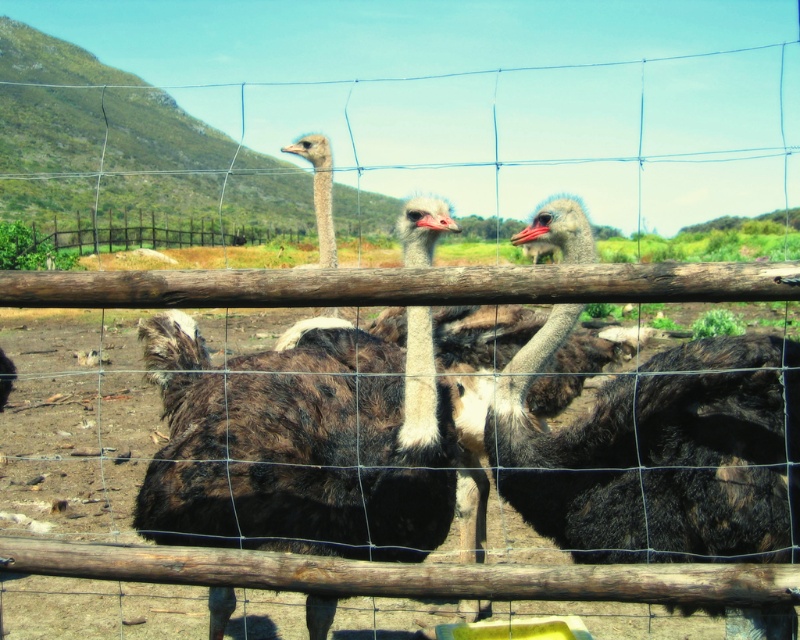
You are standing outside the enclosure looking at the dark brown feathered ostrich at center and the dark brown feathers at center. Which object is closer to you?

The dark brown feathered ostrich at center is closer to you because the dark brown feathers at center are behind it.

You are a farmer checking the ostriches in their enclosure. You notice the dark brown feathered ostrich at center and the dark brown feathers at center. Which one is closer to you?

The dark brown feathered ostrich at center is closer to you since it is only 16.64 inches away from the dark brown feathers at center, which are further back.